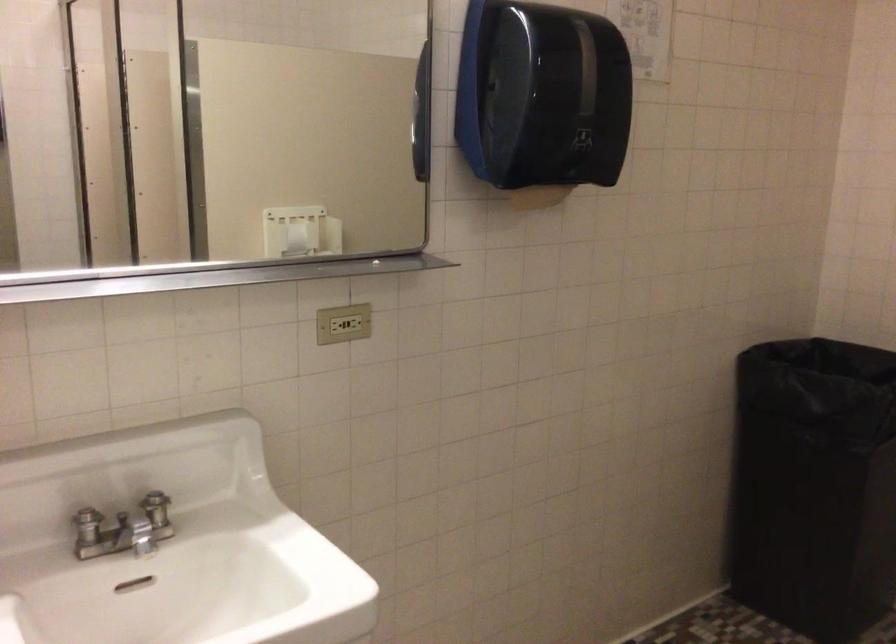
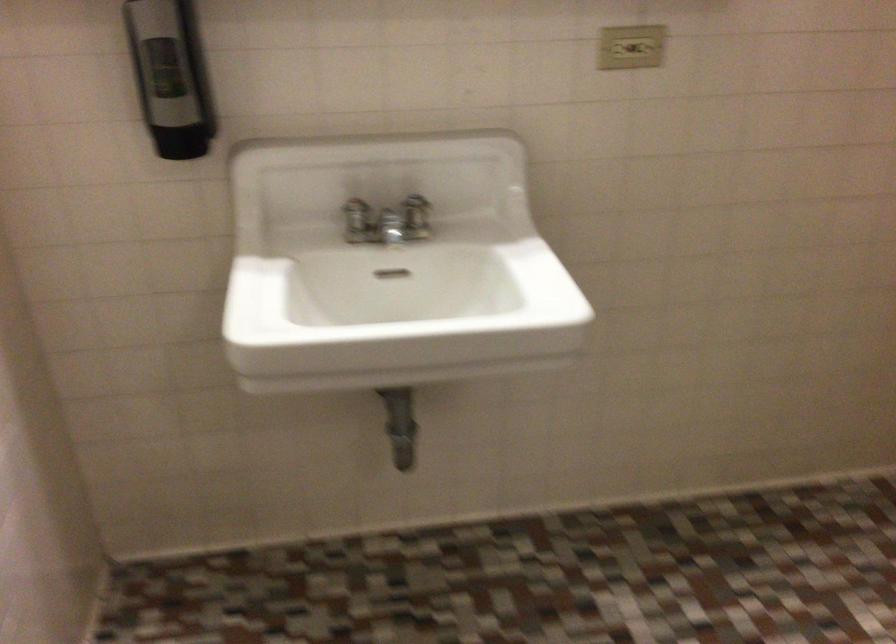
Find the pixel in the second image that matches the point at 88,533 in the first image.

(357, 221)